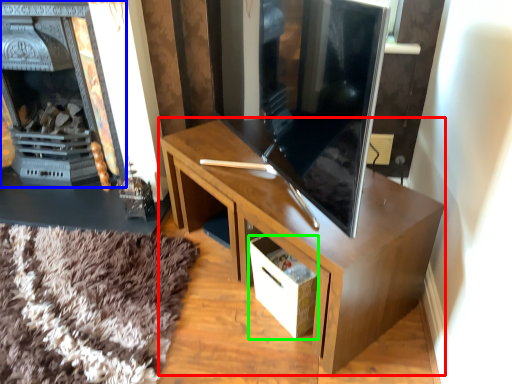
Question: Based on their relative distances, which object is farther from desk (highlighted by a red box)? Choose from fireplace (highlighted by a blue box) and drawer (highlighted by a green box).

Choices:
 (A) fireplace
 (B) drawer

Answer: (A)